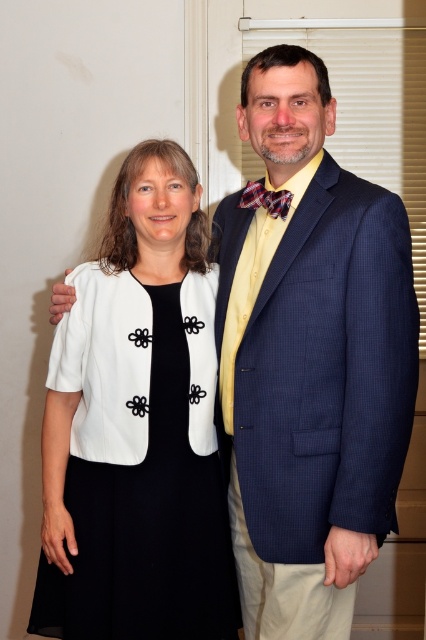
From the picture: Who is higher up, white matte dress at center or plaid fabric bow tie at center?

plaid fabric bow tie at center

Is point (103, 621) in front of point (267, 204)?

Yes, point (103, 621) is in front of point (267, 204).

Measure the distance between white matte dress at center and camera.

white matte dress at center and camera are 5.37 feet apart from each other.

The width and height of the screenshot is (426, 640). I want to click on white matte dress at center, so click(141, 467).

Does white matte dress at center have a greater width compared to navy blue textured suit at right?

Yes.

Is white matte dress at center positioned at the back of navy blue textured suit at right?

That is True.

Who is more distant from viewer, (137, 371) or (265, 216)?

Point (265, 216)

This screenshot has height=640, width=426. I want to click on white matte dress at center, so click(x=141, y=467).

Which is more to the right, navy blue textured suit at right or plaid fabric bow tie at center?

From the viewer's perspective, plaid fabric bow tie at center appears more on the right side.

Which is behind, point (255, 224) or point (282, 216)?

The point (255, 224) is more distant.

Is point (417, 497) positioned in front of point (281, 204)?

No, (417, 497) is behind (281, 204).

Locate an element on the screen. The width and height of the screenshot is (426, 640). navy blue textured suit at right is located at coordinates (411, 504).